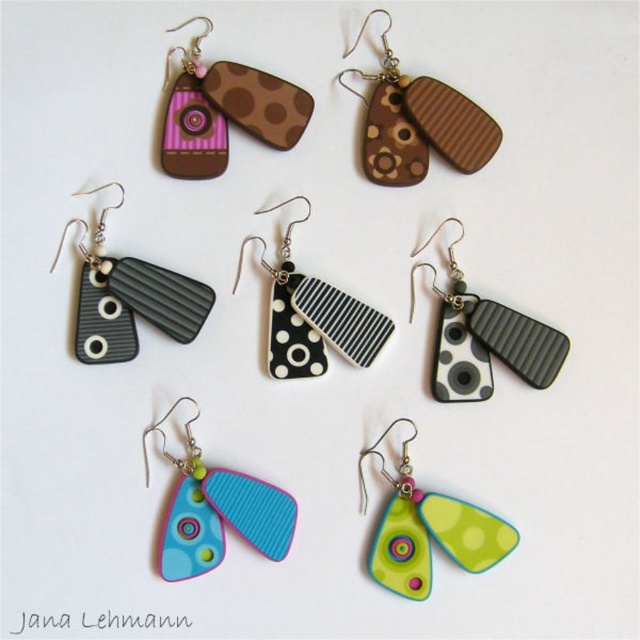
Is matte plastic earrings at center to the right of green matte/soft plastic pendant at center from the viewer's perspective?

In fact, matte plastic earrings at center is to the left of green matte/soft plastic pendant at center.

Is matte plastic earrings at center shorter than green matte/soft plastic pendant at center?

No.

In order to click on matte plastic earrings at center in this screenshot , I will do `click(216, 509)`.

This screenshot has height=640, width=640. Identify the location of matte plastic earrings at center. (216, 509).

Who is higher up, brown polka dot rectangular at upper center or matte black rectangular at left?

Positioned higher is brown polka dot rectangular at upper center.

Between brown polka dot rectangular at upper center and matte black rectangular at left, which one has more height?

With more height is matte black rectangular at left.

At what (x,y) coordinates should I click in order to perform the action: click on brown polka dot rectangular at upper center. Please return your answer as a coordinate pair (x, y). This screenshot has width=640, height=640. Looking at the image, I should click on (225, 109).

Measure the distance between point (305, 125) and camera.

Point (305, 125) and camera are 1.37 meters apart from each other.

Is brown polka dot rectangular at upper center further to the viewer compared to matte plastic earrings at center?

That is True.

Is point (202, 140) positioned behind point (189, 516)?

That is True.

Locate an element on the screen. The image size is (640, 640). brown polka dot rectangular at upper center is located at coordinates (225, 109).